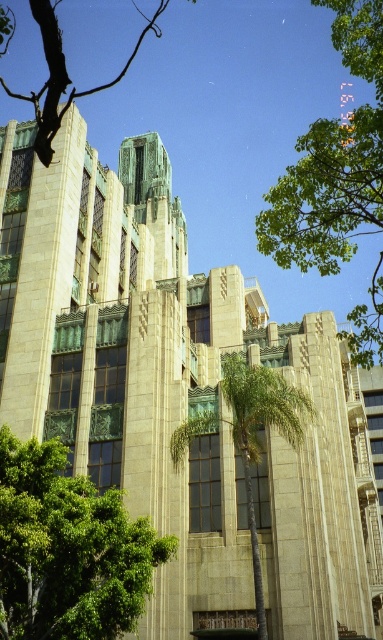
Question: Which of these objects is positioned farthest from the green leafy tree at upper right?

Choices:
 (A) green leafy tree at upper left
 (B) green leafy tree at lower left
 (C) green leafy palm tree at center

Answer: (A)

Question: Is green leafy palm tree at center bigger than green leafy tree at upper left?

Choices:
 (A) no
 (B) yes

Answer: (A)

Question: Is green leafy tree at lower left behind green leafy tree at upper right?

Choices:
 (A) yes
 (B) no

Answer: (A)

Question: Which point is closer to the camera?

Choices:
 (A) green leafy palm tree at center
 (B) green leafy tree at upper left

Answer: (B)

Question: Which point appears closest to the camera in this image?

Choices:
 (A) (206, 428)
 (B) (37, 508)
 (C) (332, 268)
 (D) (112, 84)

Answer: (C)

Question: Is green leafy tree at lower left closer to camera compared to green leafy tree at upper right?

Choices:
 (A) yes
 (B) no

Answer: (B)